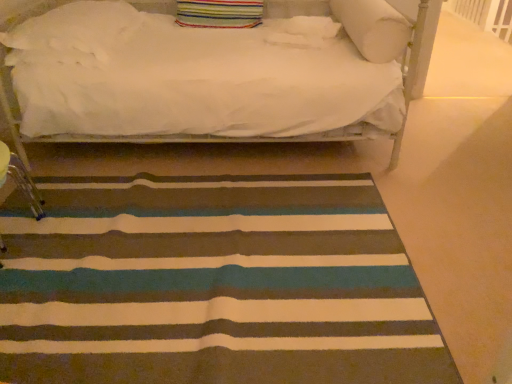
The image size is (512, 384). What do you see at coordinates (373, 28) in the screenshot? I see `white soft pillow at upper right, marked as the 1th pillow in a right-to-left arrangement` at bounding box center [373, 28].

This screenshot has height=384, width=512. I want to click on white soft pillow at upper center, acting as the second pillow starting from the right, so click(301, 31).

Measure the distance between white fluffy pillow at upper left, the 1th pillow in the left-to-right sequence, and camera.

white fluffy pillow at upper left, the 1th pillow in the left-to-right sequence, and camera are 2.10 meters apart from each other.

Where is `striped carpet at center`? The image size is (512, 384). striped carpet at center is located at coordinates (213, 284).

Locate an element on the screen. The width and height of the screenshot is (512, 384). the 3rd pillow above the striped carpet at center (from the image's perspective) is located at coordinates (373, 28).

Could you tell me if white soft pillow at upper right, marked as the 1th pillow in a right-to-left arrangement, is turned towards striped carpet at center?

No, white soft pillow at upper right, marked as the 1th pillow in a right-to-left arrangement, does not turn towards striped carpet at center.

Is white soft pillow at upper right, marked as the 1th pillow in a right-to-left arrangement, to the right of striped carpet at center from the viewer's perspective?

Correct, you'll find white soft pillow at upper right, marked as the 1th pillow in a right-to-left arrangement, to the right of striped carpet at center.

How different are the orientations of white soft pillow at upper right, which ranks as the fourth pillow in left-to-right order, and striped carpet at center in degrees?

The angular difference between white soft pillow at upper right, which ranks as the fourth pillow in left-to-right order, and striped carpet at center is 87.4 degrees.

From a real-world perspective, between striped carpet at center and white fluffy pillow at upper left, arranged as the fourth pillow when viewed from the right, who is vertically higher?

white fluffy pillow at upper left, arranged as the fourth pillow when viewed from the right, is physically above.

Considering the positions of objects striped carpet at center and white fluffy pillow at upper left, arranged as the fourth pillow when viewed from the right, in the image provided, who is behind, striped carpet at center or white fluffy pillow at upper left, arranged as the fourth pillow when viewed from the right,?

white fluffy pillow at upper left, arranged as the fourth pillow when viewed from the right, is further from the camera.

Looking at this image, who is bigger, striped carpet at center or white fluffy pillow at upper left, arranged as the fourth pillow when viewed from the right?

white fluffy pillow at upper left, arranged as the fourth pillow when viewed from the right, is bigger.

How many degrees apart are the facing directions of striped carpet at center and white fluffy pillow at upper left, arranged as the fourth pillow when viewed from the right?

They differ by 87.4 degrees in their facing directions.

Is white soft pillow at upper center, acting as the second pillow starting from the right, surrounding white fluffy pillow at upper left, arranged as the fourth pillow when viewed from the right?

That's incorrect, white fluffy pillow at upper left, arranged as the fourth pillow when viewed from the right, is not inside white soft pillow at upper center, acting as the second pillow starting from the right.

How different are the orientations of white soft pillow at upper center, acting as the second pillow starting from the right, and white fluffy pillow at upper left, arranged as the fourth pillow when viewed from the right, in degrees?

They differ by 0.000264 degrees in their facing directions.

Considering the sizes of objects white soft pillow at upper center, acting as the second pillow starting from the right, and white fluffy pillow at upper left, the 1th pillow in the left-to-right sequence, in the image provided, who is smaller, white soft pillow at upper center, acting as the second pillow starting from the right, or white fluffy pillow at upper left, the 1th pillow in the left-to-right sequence,?

white soft pillow at upper center, acting as the second pillow starting from the right, is smaller.

Are white soft pillow at upper center, acting as the second pillow starting from the right, and white fluffy pillow at upper left, the 1th pillow in the left-to-right sequence, far apart?

Yes, white soft pillow at upper center, acting as the second pillow starting from the right, and white fluffy pillow at upper left, the 1th pillow in the left-to-right sequence, are located far from each other.

Are white soft pillow at upper center, the third pillow positioned from the left, and white soft pillow at upper right, which ranks as the fourth pillow in left-to-right order, beside each other?

white soft pillow at upper center, the third pillow positioned from the left, and white soft pillow at upper right, which ranks as the fourth pillow in left-to-right order, are clearly separated.

From the image's perspective, relative to white soft pillow at upper right, which ranks as the fourth pillow in left-to-right order, is white soft pillow at upper center, the third pillow positioned from the left, above or below?

white soft pillow at upper center, the third pillow positioned from the left, is situated lower than white soft pillow at upper right, which ranks as the fourth pillow in left-to-right order, in the image.

Is white soft pillow at upper right, which ranks as the fourth pillow in left-to-right order, completely or partially inside white soft pillow at upper center, acting as the second pillow starting from the right?

That's incorrect, white soft pillow at upper right, which ranks as the fourth pillow in left-to-right order, is not inside white soft pillow at upper center, acting as the second pillow starting from the right.

From a real-world perspective, is white soft pillow at upper center, the third pillow positioned from the left, positioned above or below white soft pillow at upper right, marked as the 1th pillow in a right-to-left arrangement?

From a real-world perspective, white soft pillow at upper center, the third pillow positioned from the left, is physically below white soft pillow at upper right, marked as the 1th pillow in a right-to-left arrangement.

Considering the positions of objects striped fabric pillow at upper center, which is the 3th pillow in right-to-left order, and striped carpet at center in the image provided, who is more to the left, striped fabric pillow at upper center, which is the 3th pillow in right-to-left order, or striped carpet at center?

striped carpet at center.

Is point (261, 15) more distant than point (56, 319)?

That is True.

Considering the relative sizes of striped fabric pillow at upper center, which is the 3th pillow in right-to-left order, and striped carpet at center in the image provided, is striped fabric pillow at upper center, which is the 3th pillow in right-to-left order, thinner than striped carpet at center?

Correct, the width of striped fabric pillow at upper center, which is the 3th pillow in right-to-left order, is less than that of striped carpet at center.

From a real-world perspective, is striped carpet at center beneath white soft pillow at upper center, acting as the second pillow starting from the right?

Yes, from a real-world perspective, striped carpet at center is beneath white soft pillow at upper center, acting as the second pillow starting from the right.

Between point (269, 238) and point (334, 32), which one is positioned behind?

The point (334, 32) is farther.

From the image's perspective, is striped carpet at center on white soft pillow at upper center, acting as the second pillow starting from the right?

No.

How many degrees apart are the facing directions of white soft pillow at upper center, acting as the second pillow starting from the right, and striped carpet at center?

white soft pillow at upper center, acting as the second pillow starting from the right, and striped carpet at center are facing 87.4 degrees away from each other.

Considering the relative sizes of white soft pillow at upper center, acting as the second pillow starting from the right, and striped carpet at center in the image provided, is white soft pillow at upper center, acting as the second pillow starting from the right, thinner than striped carpet at center?

Yes, white soft pillow at upper center, acting as the second pillow starting from the right, is thinner than striped carpet at center.

From the picture: Considering their positions, is white soft pillow at upper center, the third pillow positioned from the left, located in front of or behind striped carpet at center?

In the image, white soft pillow at upper center, the third pillow positioned from the left, appears behind striped carpet at center.

From a real-world perspective, which object stands above the other?

From a 3D spatial view, white soft pillow at upper center, the third pillow positioned from the left, is above.

Locate an element on the screen. mat in front of the white soft pillow at upper right, which ranks as the fourth pillow in left-to-right order is located at coordinates (213, 284).

Locate an element on the screen. The width and height of the screenshot is (512, 384). the 2nd pillow behind the striped carpet at center is located at coordinates (72, 29).

Estimate the real-world distances between objects in this image. Which object is closer to white soft pillow at upper center, acting as the second pillow starting from the right, striped carpet at center or white soft pillow at upper right, marked as the 1th pillow in a right-to-left arrangement?

white soft pillow at upper right, marked as the 1th pillow in a right-to-left arrangement.

Estimate the real-world distances between objects in this image. Which object is further from striped fabric pillow at upper center, which is the 3th pillow in right-to-left order, white soft pillow at upper right, marked as the 1th pillow in a right-to-left arrangement, or white soft pillow at upper center, the third pillow positioned from the left?

white soft pillow at upper right, marked as the 1th pillow in a right-to-left arrangement.

Looking at the image, which one is located closer to white fluffy pillow at upper left, arranged as the fourth pillow when viewed from the right, striped carpet at center or striped fabric pillow at upper center, which is the 3th pillow in right-to-left order?

striped fabric pillow at upper center, which is the 3th pillow in right-to-left order, is closer to white fluffy pillow at upper left, arranged as the fourth pillow when viewed from the right.

Based on their spatial positions, is striped fabric pillow at upper center, which is the 3th pillow in right-to-left order, or white soft pillow at upper right, marked as the 1th pillow in a right-to-left arrangement, closer to striped carpet at center?

white soft pillow at upper right, marked as the 1th pillow in a right-to-left arrangement, is closer to striped carpet at center.

Which object lies further to the anchor point striped carpet at center, striped fabric pillow at upper center, which is the 3th pillow in right-to-left order, or white fluffy pillow at upper left, the 1th pillow in the left-to-right sequence?

The object further to striped carpet at center is striped fabric pillow at upper center, which is the 3th pillow in right-to-left order.

When comparing their distances from white soft pillow at upper center, the third pillow positioned from the left, does striped fabric pillow at upper center, which is the 3th pillow in right-to-left order, or white fluffy pillow at upper left, the 1th pillow in the left-to-right sequence, seem further?

Among the two, white fluffy pillow at upper left, the 1th pillow in the left-to-right sequence, is located further to white soft pillow at upper center, the third pillow positioned from the left.

Looking at the image, which one is located further to white soft pillow at upper center, the third pillow positioned from the left, striped carpet at center or white fluffy pillow at upper left, arranged as the fourth pillow when viewed from the right?

Among the two, striped carpet at center is located further to white soft pillow at upper center, the third pillow positioned from the left.

When comparing their distances from white soft pillow at upper center, acting as the second pillow starting from the right, does white fluffy pillow at upper left, the 1th pillow in the left-to-right sequence, or white soft pillow at upper right, which ranks as the fourth pillow in left-to-right order, seem closer?

white soft pillow at upper right, which ranks as the fourth pillow in left-to-right order, lies closer to white soft pillow at upper center, acting as the second pillow starting from the right, than the other object.

Identify the location of mat between white fluffy pillow at upper left, the 1th pillow in the left-to-right sequence, and white soft pillow at upper right, which ranks as the fourth pillow in left-to-right order. (213, 284).

The height and width of the screenshot is (384, 512). Identify the location of pillow between white fluffy pillow at upper left, arranged as the fourth pillow when viewed from the right, and white soft pillow at upper center, the third pillow positioned from the left. (219, 13).

Find the location of a particular element. This screenshot has height=384, width=512. pillow between white soft pillow at upper center, the third pillow positioned from the left, and striped carpet at center from top to bottom is located at coordinates (72, 29).

The image size is (512, 384). I want to click on pillow situated between striped fabric pillow at upper center, which is the 3th pillow in right-to-left order, and white soft pillow at upper right, marked as the 1th pillow in a right-to-left arrangement, from left to right, so click(x=301, y=31).